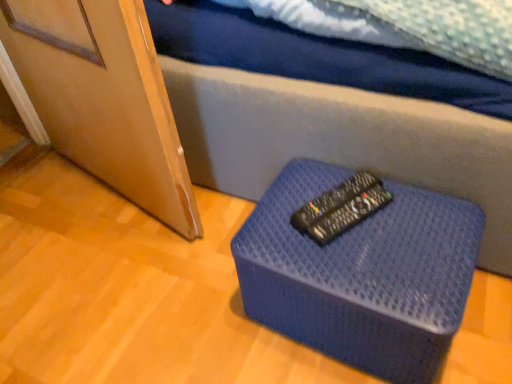
Describe the element at coordinates (362, 275) in the screenshot. This screenshot has width=512, height=384. I see `blue textured ottoman at center` at that location.

In order to click on blue textured ottoman at center in this screenshot , I will do `click(362, 275)`.

What is the approximate height of black plastic remote at center?

black plastic remote at center is 0.95 inches in height.

What do you see at coordinates (332, 202) in the screenshot?
I see `black plastic remote at center` at bounding box center [332, 202].

I want to click on black plastic remote at center, so click(x=332, y=202).

Where is `blue textured ottoman at center`? This screenshot has height=384, width=512. blue textured ottoman at center is located at coordinates (362, 275).

In the image, is blue textured ottoman at center on the left side or the right side of black plastic remote at center?

blue textured ottoman at center is to the right of black plastic remote at center.

Which object is closer to the camera taking this photo, blue textured ottoman at center or black plastic remote at center?

blue textured ottoman at center is more forward.

Which is closer to the camera, [408,379] or [312,235]?

The point [408,379] is in front.

From the image's perspective, who appears lower, blue textured ottoman at center or black plastic remote at center?

blue textured ottoman at center is shown below in the image.

From a real-world perspective, between blue textured ottoman at center and black plastic remote at center, who is vertically lower?

blue textured ottoman at center is physically lower.

Which object is wider, blue textured ottoman at center or black plastic remote at center?

blue textured ottoman at center is wider.

Which of these two, blue textured ottoman at center or black plastic remote at center, stands shorter?

black plastic remote at center.

Based on their sizes in the image, would you say blue textured ottoman at center is bigger or smaller than black plastic remote at center?

Clearly, blue textured ottoman at center is larger in size than black plastic remote at center.

Would you say blue textured ottoman at center is inside or outside black plastic remote at center?

blue textured ottoman at center lies outside black plastic remote at center.

Is blue textured ottoman at center far from black plastic remote at center?

A: No.

Is blue textured ottoman at center looking in the opposite direction of black plastic remote at center?

No, black plastic remote at center is not at the back of blue textured ottoman at center.

What are the coordinates of `control behind the blue textured ottoman at center` in the screenshot? It's located at (332, 202).

Is black plastic remote at center to the left or to the right of blue textured ottoman at center in the image?

Clearly, black plastic remote at center is on the left of blue textured ottoman at center in the image.

Is the position of black plastic remote at center more distant than that of blue textured ottoman at center?

Yes.

Is point (327, 194) positioned after point (318, 304)?

Yes, it is behind point (318, 304).

From the image's perspective, is black plastic remote at center below blue textured ottoman at center?

No.

From a real-world perspective, is black plastic remote at center over blue textured ottoman at center?

Correct, in the physical world, black plastic remote at center is higher than blue textured ottoman at center.

Considering the relative sizes of black plastic remote at center and blue textured ottoman at center in the image provided, is black plastic remote at center thinner than blue textured ottoman at center?

Yes, black plastic remote at center is thinner than blue textured ottoman at center.

In the scene shown: Is black plastic remote at center shorter than blue textured ottoman at center?

Yes, black plastic remote at center is shorter than blue textured ottoman at center.

Is black plastic remote at center bigger or smaller than blue textured ottoman at center?

Considering their sizes, black plastic remote at center takes up less space than blue textured ottoman at center.

Choose the correct answer: Is black plastic remote at center inside blue textured ottoman at center or outside it?

black plastic remote at center cannot be found inside blue textured ottoman at center.

Is black plastic remote at center directly adjacent to blue textured ottoman at center?

black plastic remote at center and blue textured ottoman at center are not in contact.

Is black plastic remote at center oriented towards blue textured ottoman at center?

No, black plastic remote at center is not turned towards blue textured ottoman at center.

Can you tell me how much black plastic remote at center and blue textured ottoman at center differ in facing direction?

They differ by 28.1 degrees in their facing directions.

The height and width of the screenshot is (384, 512). In the image, there is a black plastic remote at center. Find the location of `furniture below it (from the image's perspective)`. furniture below it (from the image's perspective) is located at coordinates [x=362, y=275].

Locate an element on the screen. This screenshot has height=384, width=512. furniture in front of the black plastic remote at center is located at coordinates (362, 275).

Find the location of a particular element. This screenshot has width=512, height=384. furniture below the black plastic remote at center (from a real-world perspective) is located at coordinates (362, 275).